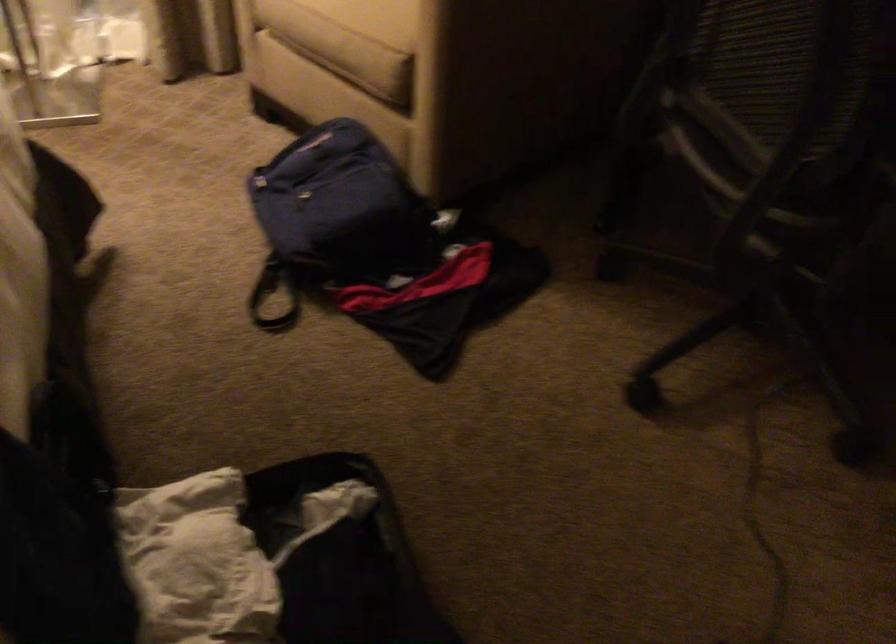
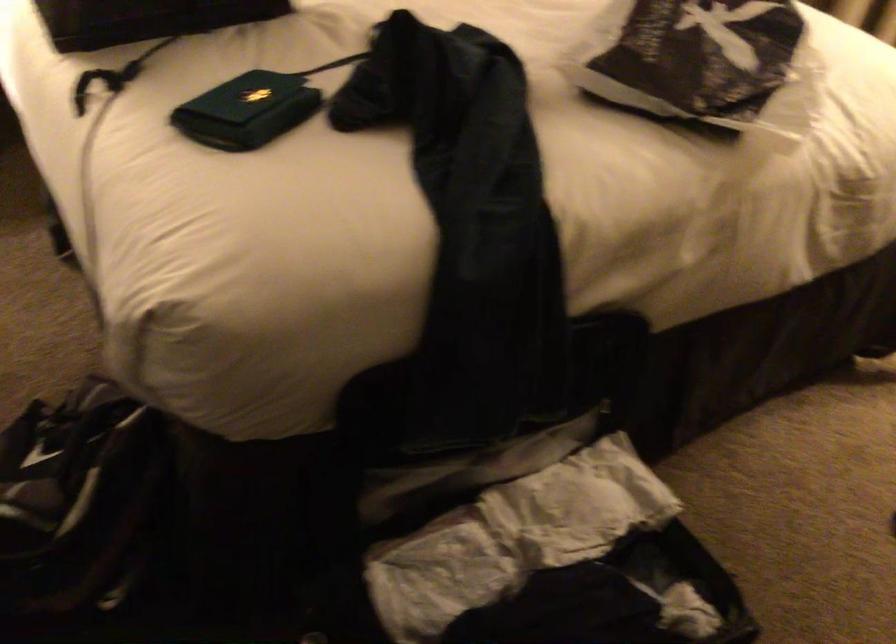
Based on the continuous images, in which direction is the camera rotating?

The camera rotated toward left-down.